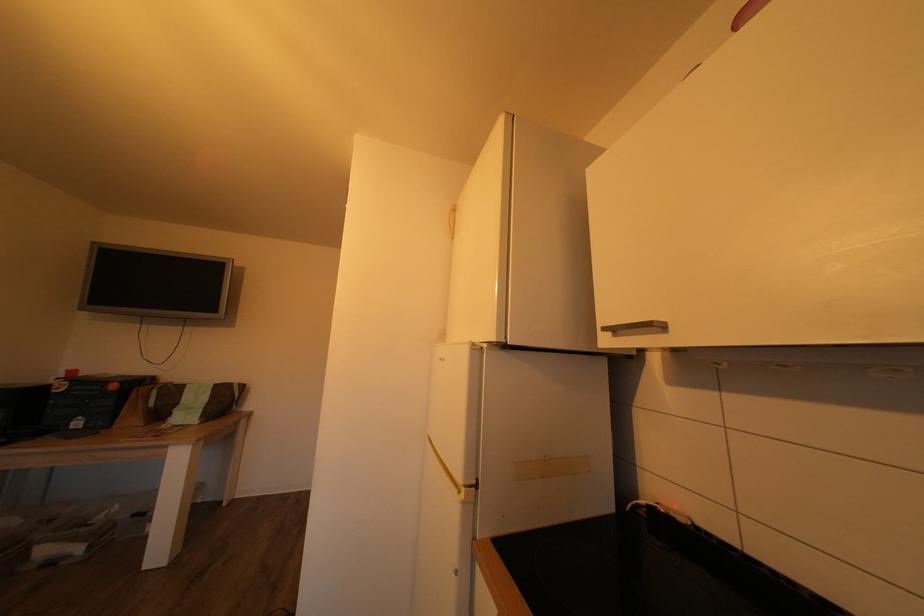
This screenshot has width=924, height=616. Describe the element at coordinates (636, 328) in the screenshot. I see `the silver cabinet handle` at that location.